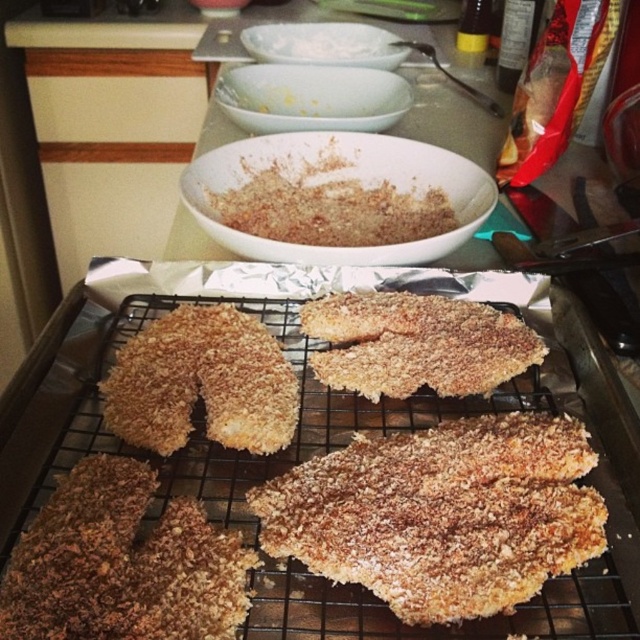
You are a delivery robot with a height of 24 inches. You need to deliver a package to a location marked by the point at coordinates point (205, 424). Can you safely pass under any obstacles along the way?

The distance between point (205, 424) and the camera is 21.95 inches. Since the robot is 24 inches tall, it is 2.05 inches taller than the available clearance, so it cannot safely pass under any obstacles along the way.